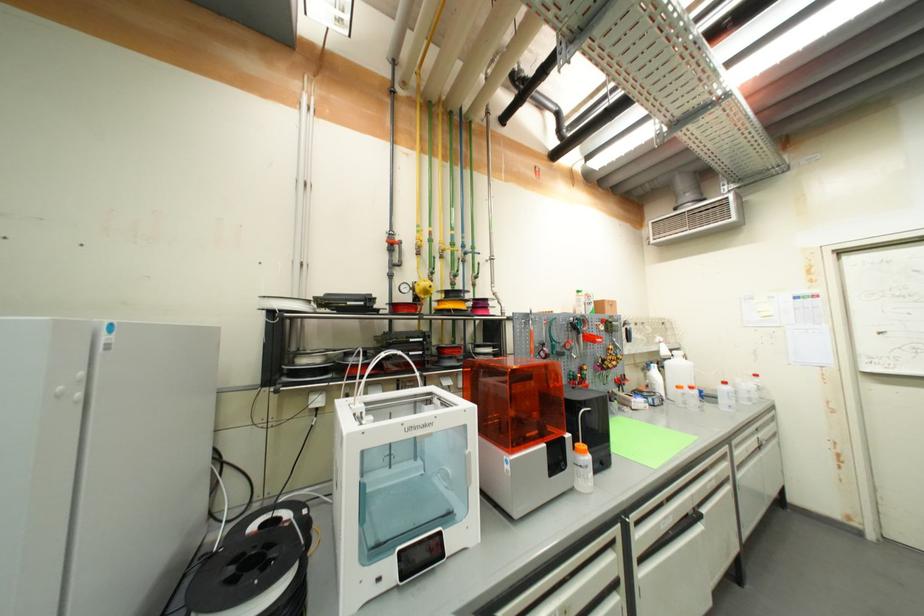
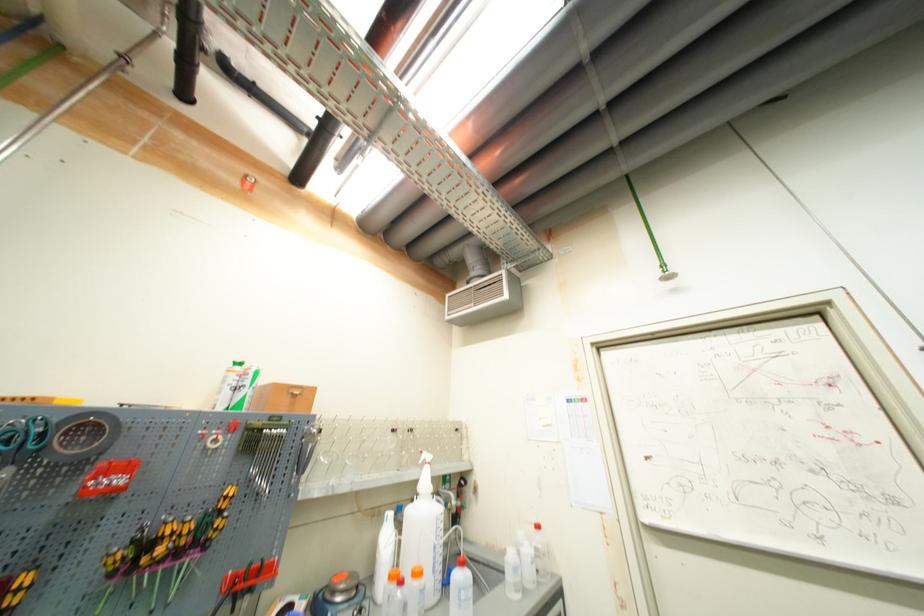
In the second image, find the point that corresponds to the point at 760,398 in the first image.

(533, 578)